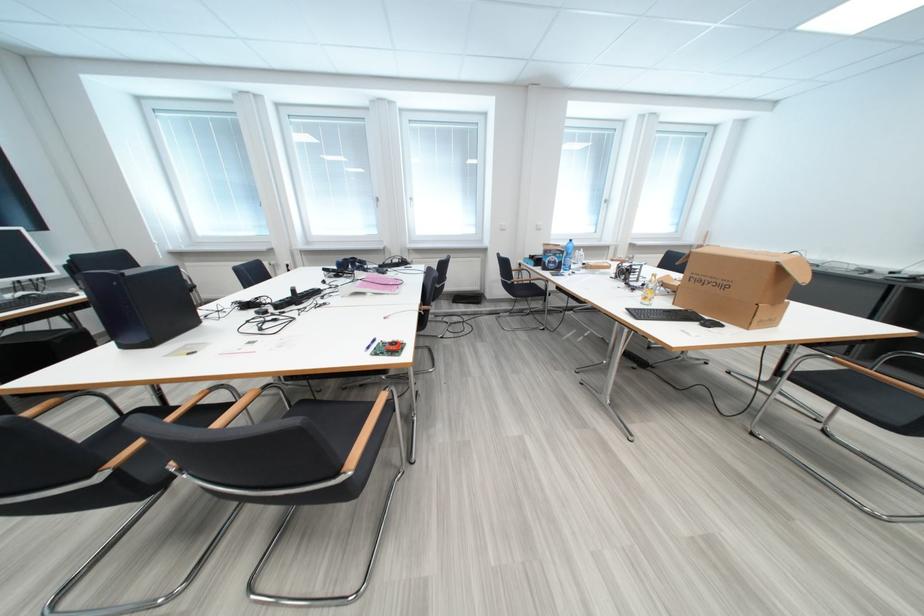
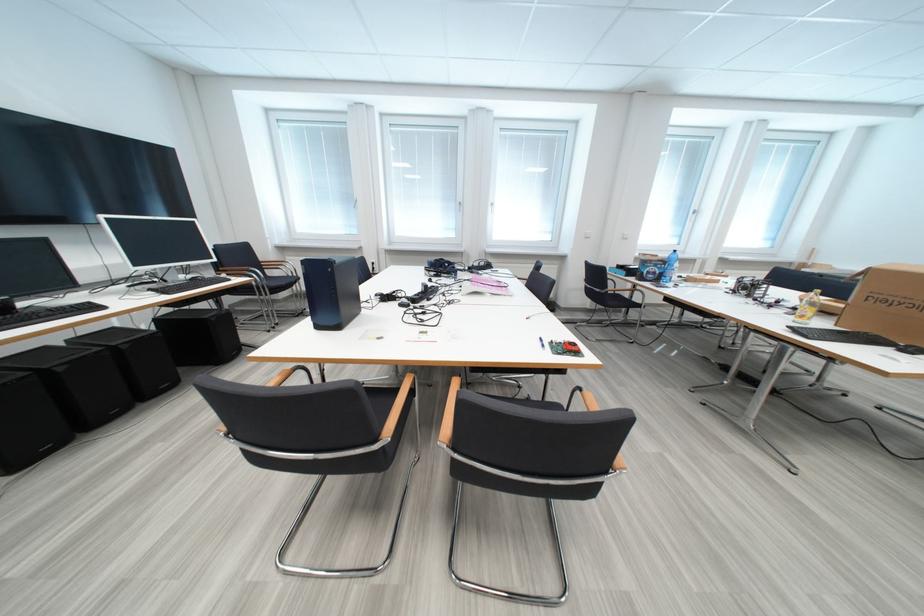
Question: In a continuous first-person perspective shot, in which direction is the camera moving?

Choices:
 (A) Left
 (B) Right
 (C) Forward
 (D) Backward

Answer: (A)